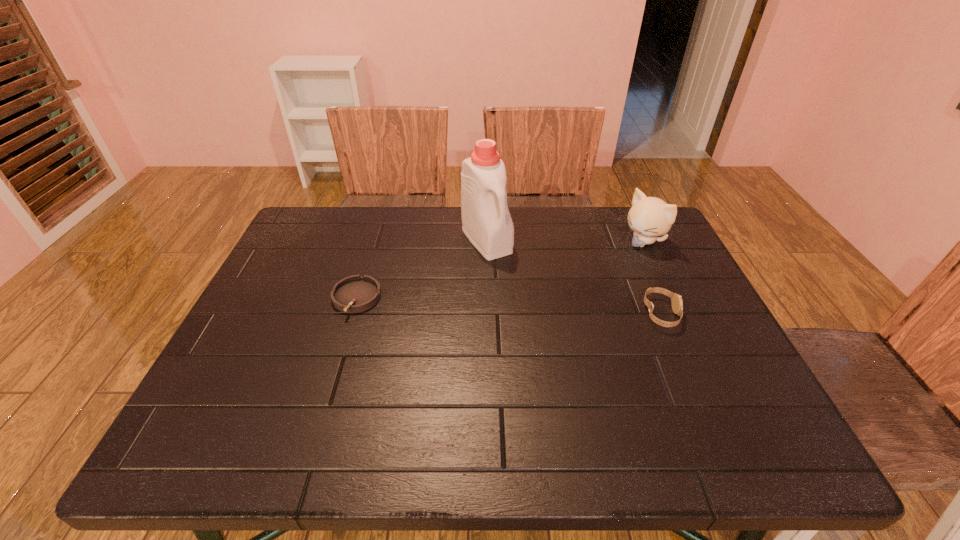
Locate an element on the screen. the leftmost object is located at coordinates (354, 294).

The height and width of the screenshot is (540, 960). I want to click on the shortest object, so click(354, 294).

Where is `watch`? The image size is (960, 540). watch is located at coordinates (676, 301).

The image size is (960, 540). I want to click on detergent, so click(x=487, y=223).

Image resolution: width=960 pixels, height=540 pixels. Identify the location of the tallest object. (487, 223).

Find the location of `kitten`. kitten is located at coordinates (649, 217).

Find the location of `vacant region located 0.230m on the front of the ashtray`. vacant region located 0.230m on the front of the ashtray is located at coordinates pos(325,401).

The width and height of the screenshot is (960, 540). I want to click on free space located 0.070m on the face of the watch, so click(x=706, y=314).

Identify the location of free space located on the handle side of the detergent. The image size is (960, 540). (551, 325).

Find the location of a particular element. Image resolution: width=960 pixels, height=540 pixels. free space located on the handle side of the detergent is located at coordinates (570, 348).